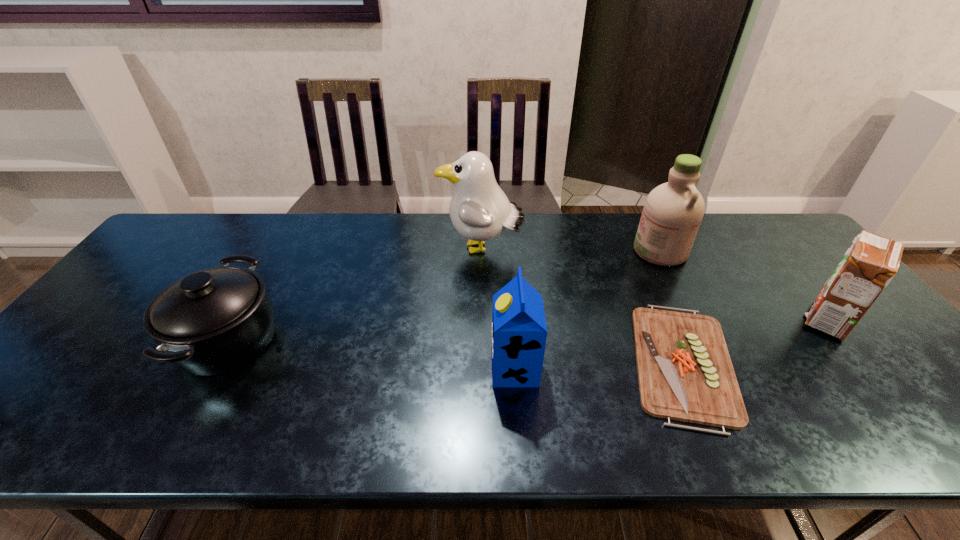
Identify the location of object that is the closest to the leftmost object. (479, 210).

Find the location of a particular element. This screenshot has width=960, height=540. free point that satisfies the following two spatial constraints: 1. on the beak of the gull; 2. on the back side of the shortest object is located at coordinates (481, 363).